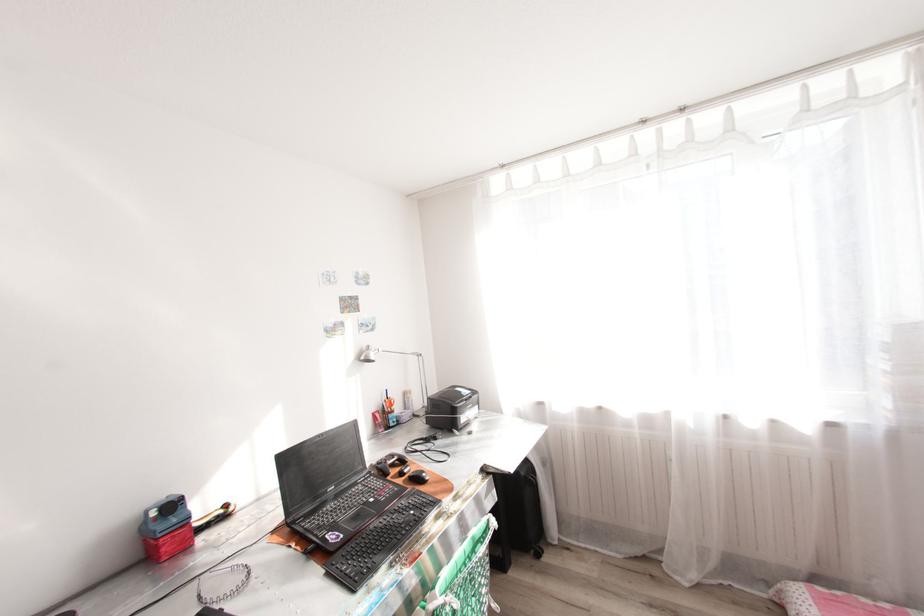
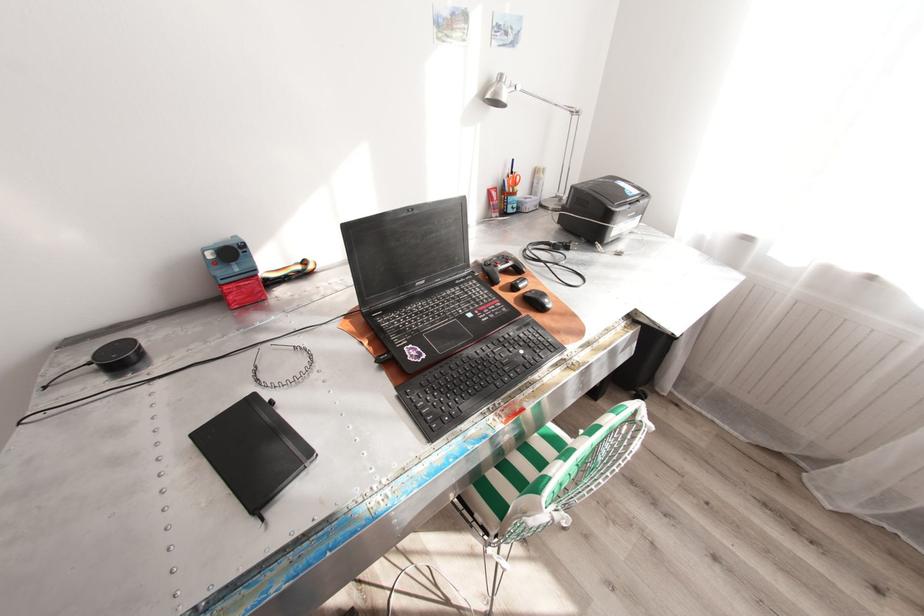
Find the pixel in the second image that matches point (392, 398) in the first image.

(517, 172)